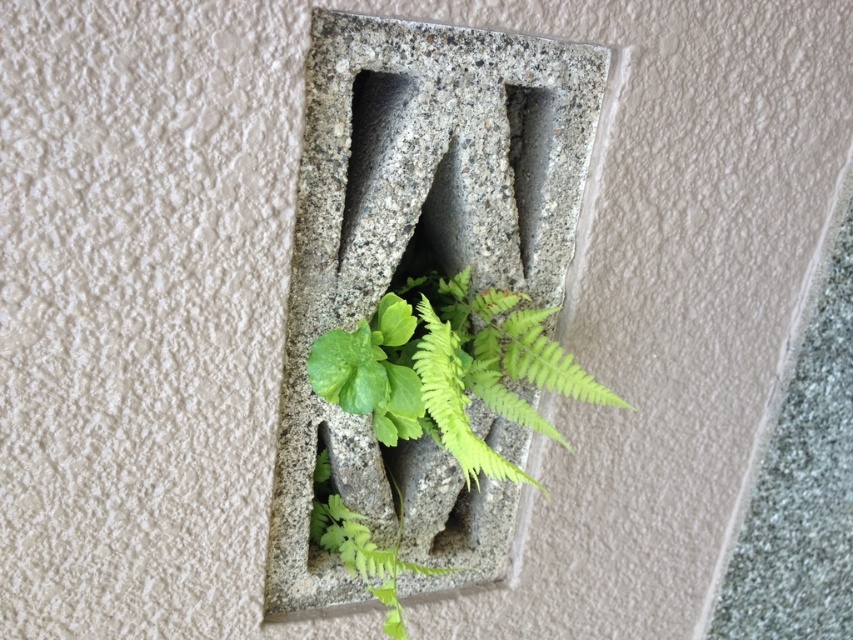
Can you confirm if granite stone at center is thinner than green leafy plant at center?

No.

Does granite stone at center have a smaller size compared to green leafy plant at center?

Actually, granite stone at center might be larger than green leafy plant at center.

Where is `granite stone at center`? Image resolution: width=853 pixels, height=640 pixels. granite stone at center is located at coordinates (426, 259).

The width and height of the screenshot is (853, 640). I want to click on granite stone at center, so click(x=426, y=259).